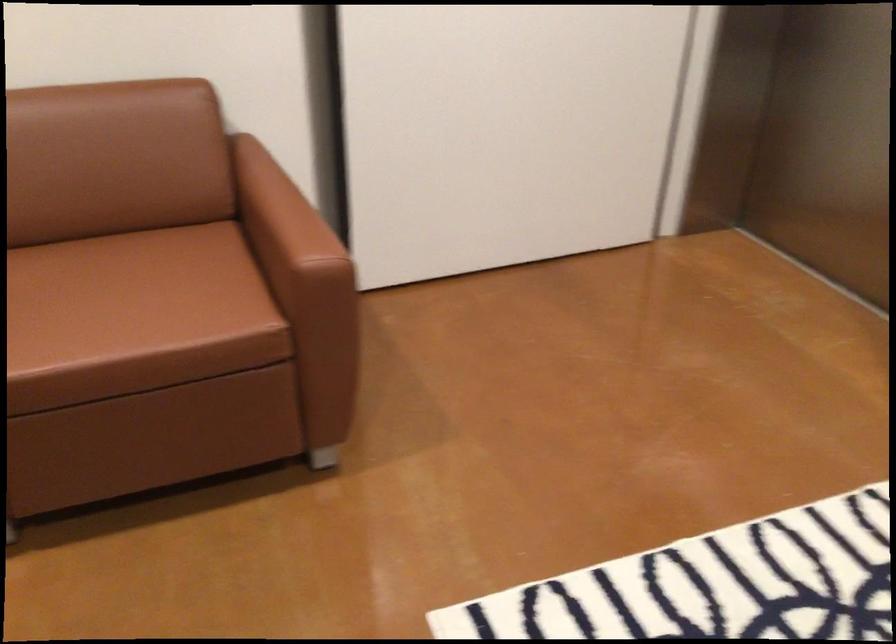
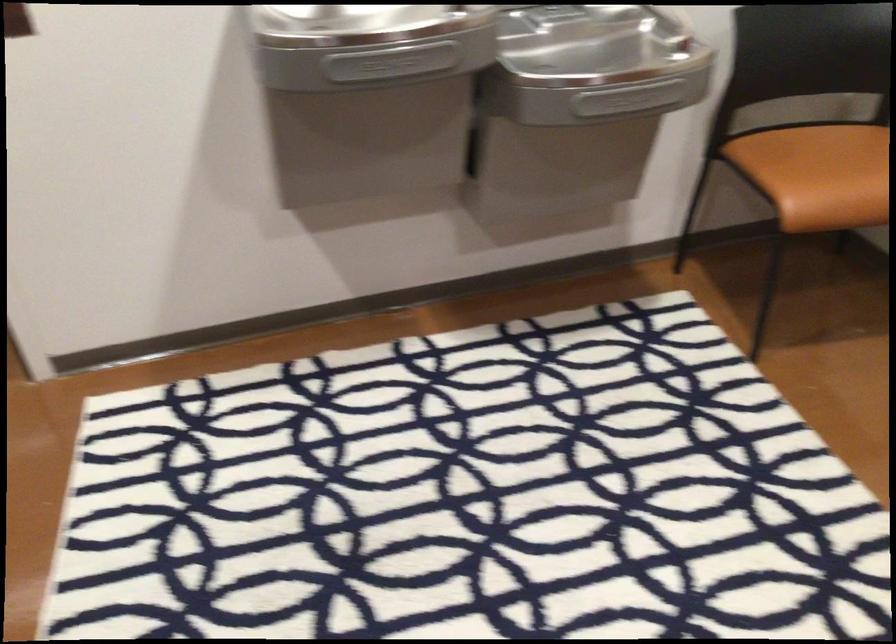
First-person continuous shooting, in which direction is the camera rotating?

The camera rotated toward right-down.